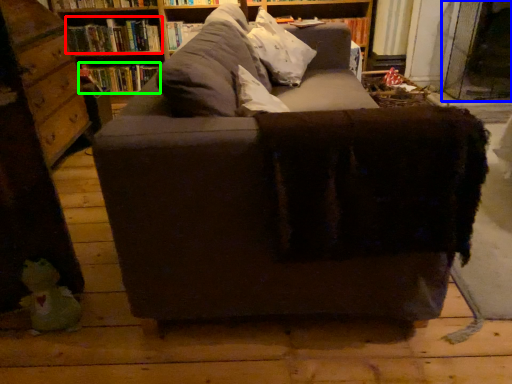
Question: Which object is the closest to the book (highlighted by a red box)? Choose among these: glass door (highlighted by a blue box) or book (highlighted by a green box).

Choices:
 (A) glass door
 (B) book

Answer: (B)